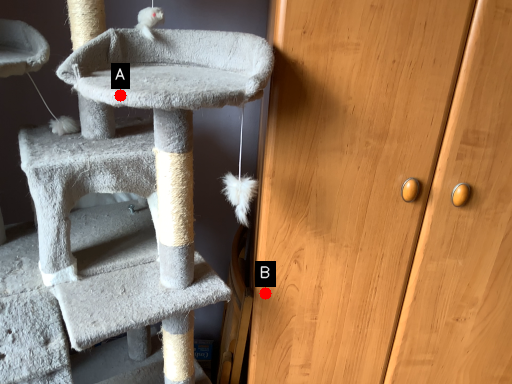
Question: Two points are circled on the image, labeled by A and B beside each circle. Which point is closer to the camera?

Choices:
 (A) A is closer
 (B) B is closer

Answer: (A)